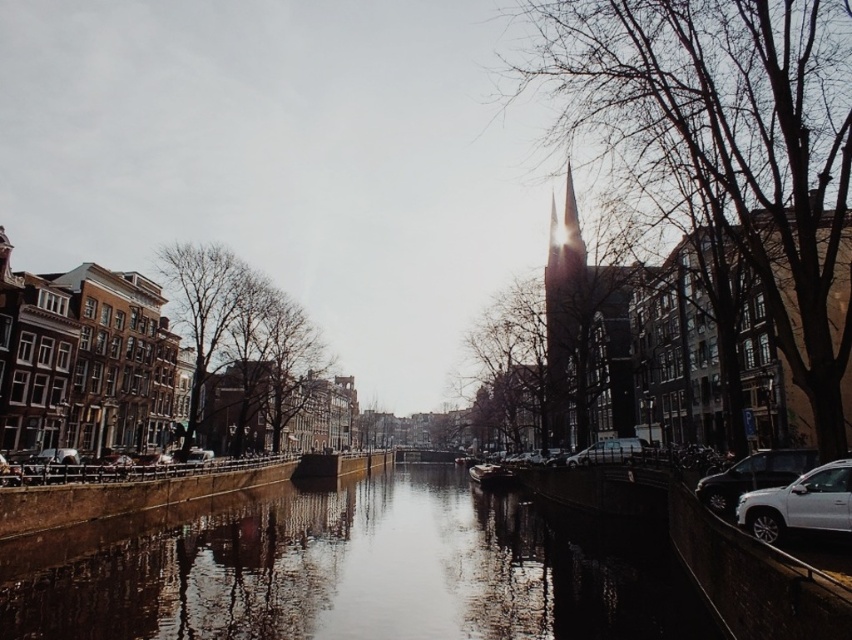
Which is more to the right, smooth concrete water at center or shiny silver suv at right?

From the viewer's perspective, shiny silver suv at right appears more on the right side.

This screenshot has height=640, width=852. I want to click on smooth concrete water at center, so click(344, 570).

Is bare branches at left above shiny silver suv at right?

Yes.

Does bare branches at left have a smaller size compared to shiny silver suv at right?

Incorrect, bare branches at left is not smaller in size than shiny silver suv at right.

Between point (277, 324) and point (721, 483), which one is positioned in front?

Point (721, 483) is in front.

The image size is (852, 640). I want to click on bare branches at left, so click(240, 344).

Measure the distance between point (574, 637) and camera.

Point (574, 637) is 298.73 feet away from camera.

Can you confirm if smooth concrete water at center is thinner than white matte suv at lower right?

No.

Does point (703, 634) come closer to viewer compared to point (809, 508)?

No, it is behind (809, 508).

At what (x,y) coordinates should I click in order to perform the action: click on smooth concrete water at center. Please return your answer as a coordinate pair (x, y). The image size is (852, 640). Looking at the image, I should click on (344, 570).